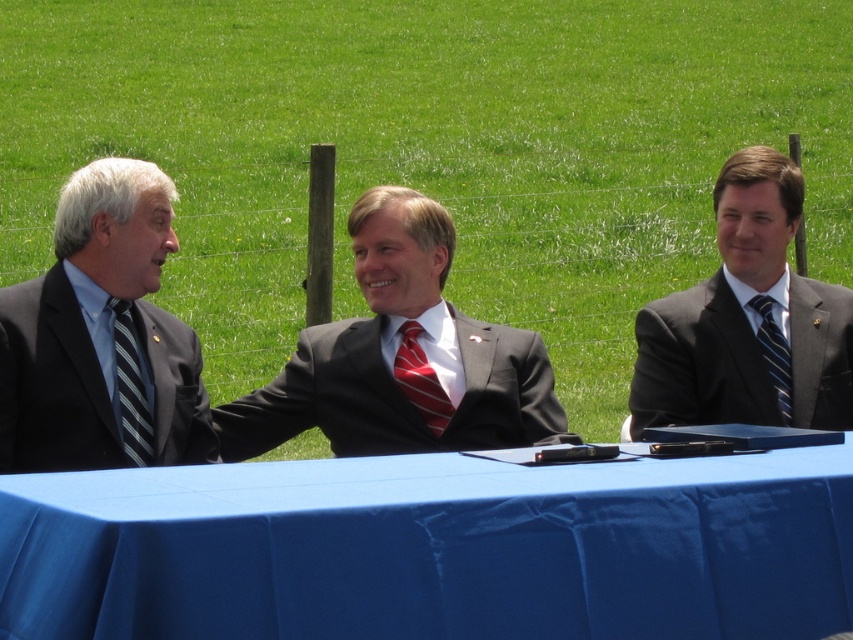
You are a photographer standing 2 meters away from the table. You want to take a photo of both the red striped tie at center and the blue striped tie at right in the same frame. Can you fit both of them in the frame if your camera has a 1.2 meter wide field of view?

The red striped tie at center and blue striped tie at right are 1.08 meters apart from each other. Since the distance between them is less than the camera field of view of 1.2 meters, both can be captured in the same frame.

You are a tailor observing the striped silk tie at left and the blue striped tie at right. Which tie has a wider width?

The striped silk tie at left is wider than the blue striped tie at right according to the description.

You are organizing a formal event and need to ensure that the matte black suit at center and the blue striped tie at right are displayed properly. Based on their sizes, which one would require a larger display space?

The matte black suit at center requires a larger display space since it has a larger size compared to the blue striped tie at right.